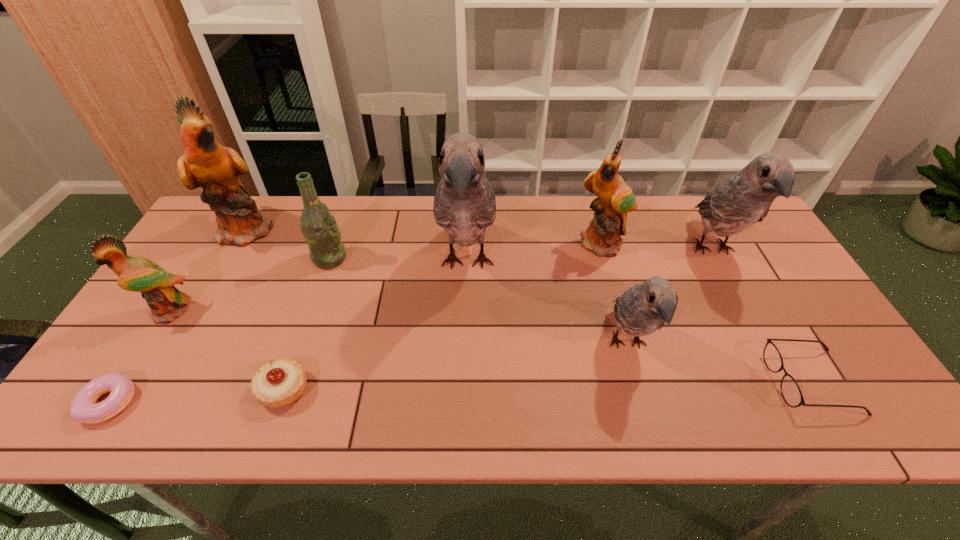
Where is `beige pastry`? beige pastry is located at coordinates (279, 383).

Where is `the second shortest object`? the second shortest object is located at coordinates (790, 390).

Identify the location of purple doughnut. This screenshot has width=960, height=540. (83, 408).

Where is `doughnut`? The image size is (960, 540). doughnut is located at coordinates [83, 408].

Locate an element on the screen. free location located on the front-facing side of the biggest green parrot is located at coordinates (402, 230).

Identify the location of vacant space situated 0.110m on the front-facing side of the fourth parrot from right to left. (464, 351).

Find the location of a particular element. This screenshot has height=540, width=960. free space located 0.290m on the front-facing side of the second biggest green parrot is located at coordinates (631, 341).

Image resolution: width=960 pixels, height=540 pixels. In order to click on free location located 0.240m on the front-facing side of the rightmost parrot in this screenshot , I will do `click(774, 363)`.

Locate an element on the screen. free region located 0.350m on the surface of the green beer bottle is located at coordinates (466, 258).

In order to click on blank space located 0.280m on the front-facing side of the nearest green parrot in this screenshot , I will do `click(94, 433)`.